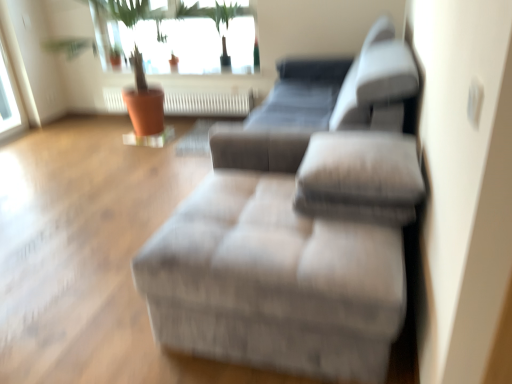
Measure the distance between transparent glass window at upper center, acting as the 1th window starting from the right, and camera.

transparent glass window at upper center, acting as the 1th window starting from the right, is 3.74 meters from camera.

Locate an element on the screen. silver metallic radiator at center is located at coordinates (211, 103).

From a real-world perspective, between silver metallic radiator at center and textured gray ottoman at center, who is vertically higher?

textured gray ottoman at center.

Is silver metallic radiator at center at the left side of textured gray ottoman at center?

Indeed, silver metallic radiator at center is positioned on the left side of textured gray ottoman at center.

Is point (232, 115) less distant than point (412, 161)?

No.

Looking at this image, can we say white glass window at upper left, which is the 2th window from right to left, lies outside silver metallic radiator at center?

white glass window at upper left, which is the 2th window from right to left, is positioned outside silver metallic radiator at center.

At what (x,y) coordinates should I click in order to perform the action: click on window on the left of silver metallic radiator at center. Please return your answer as a coordinate pair (x, y). Looking at the image, I should click on (10, 99).

Is white glass window at upper left, which is the 2th window from right to left, facing towards silver metallic radiator at center?

No, white glass window at upper left, which is the 2th window from right to left, is not turned towards silver metallic radiator at center.

Which of these two, white glass window at upper left, which ranks as the 1th window in left-to-right order, or silver metallic radiator at center, is bigger?

Bigger between the two is silver metallic radiator at center.

Does point (212, 92) come closer to viewer compared to point (231, 42)?

That is False.

How distant is silver metallic radiator at center from transparent glass window at upper center, acting as the 1th window starting from the right?

The distance of silver metallic radiator at center from transparent glass window at upper center, acting as the 1th window starting from the right, is 22.61 inches.

Where is `radiator located on the left of transparent glass window at upper center, which ranks as the second window in left-to-right order`? The image size is (512, 384). radiator located on the left of transparent glass window at upper center, which ranks as the second window in left-to-right order is located at coordinates (211, 103).

Can you confirm if silver metallic radiator at center is smaller than transparent glass window at upper center, which ranks as the second window in left-to-right order?

Correct, silver metallic radiator at center occupies less space than transparent glass window at upper center, which ranks as the second window in left-to-right order.

Can you confirm if textured gray ottoman at center is thinner than white glass window at upper left, which ranks as the 1th window in left-to-right order?

Incorrect, the width of textured gray ottoman at center is not less than that of white glass window at upper left, which ranks as the 1th window in left-to-right order.

Is textured gray ottoman at center in contact with white glass window at upper left, which ranks as the 1th window in left-to-right order?

No, textured gray ottoman at center is not making contact with white glass window at upper left, which ranks as the 1th window in left-to-right order.

From a real-world perspective, is textured gray ottoman at center positioned over white glass window at upper left, which ranks as the 1th window in left-to-right order, based on gravity?

Actually, textured gray ottoman at center is physically below white glass window at upper left, which ranks as the 1th window in left-to-right order, in the real world.

Considering the positions of objects white glass window at upper left, which is the 2th window from right to left, and textured gray ottoman at center in the image provided, who is behind, white glass window at upper left, which is the 2th window from right to left, or textured gray ottoman at center?

white glass window at upper left, which is the 2th window from right to left, is more distant.

Considering the positions of points (9, 62) and (365, 230), is point (9, 62) farther from camera compared to point (365, 230)?

Yes, it is.

Which is more to the left, white glass window at upper left, which ranks as the 1th window in left-to-right order, or textured gray ottoman at center?

Positioned to the left is white glass window at upper left, which ranks as the 1th window in left-to-right order.

From the picture: From the image's perspective, is white glass window at upper left, which is the 2th window from right to left, under textured gray ottoman at center?

Actually, white glass window at upper left, which is the 2th window from right to left, appears above textured gray ottoman at center in the image.

Between point (233, 96) and point (0, 113), which one is positioned behind?

Point (0, 113)

Would you say silver metallic radiator at center is inside or outside white glass window at upper left, which is the 2th window from right to left?

silver metallic radiator at center is outside white glass window at upper left, which is the 2th window from right to left.

Which object is thinner, silver metallic radiator at center or white glass window at upper left, which is the 2th window from right to left?

white glass window at upper left, which is the 2th window from right to left, is thinner.

From the image's perspective, is silver metallic radiator at center on white glass window at upper left, which is the 2th window from right to left?

No.

From the picture: Based on their positions, is transparent glass window at upper center, acting as the 1th window starting from the right, located to the left or right of textured gray ottoman at center?

In the image, transparent glass window at upper center, acting as the 1th window starting from the right, appears on the left side of textured gray ottoman at center.

Is transparent glass window at upper center, acting as the 1th window starting from the right, taller or shorter than textured gray ottoman at center?

In the image, transparent glass window at upper center, acting as the 1th window starting from the right, appears to be taller than textured gray ottoman at center.

Is transparent glass window at upper center, which ranks as the second window in left-to-right order, turned away from textured gray ottoman at center?

No.

Is the surface of transparent glass window at upper center, acting as the 1th window starting from the right, in direct contact with textured gray ottoman at center?

No, transparent glass window at upper center, acting as the 1th window starting from the right, is not in contact with textured gray ottoman at center.

Where is `studio couch below the silver metallic radiator at center (from the image's perspective)`? This screenshot has width=512, height=384. studio couch below the silver metallic radiator at center (from the image's perspective) is located at coordinates (298, 234).

The image size is (512, 384). In order to click on radiator that is behind the white glass window at upper left, which is the 2th window from right to left in this screenshot , I will do `click(211, 103)`.

Considering their positions, is white glass window at upper left, which is the 2th window from right to left, positioned further to textured gray ottoman at center than silver metallic radiator at center?

white glass window at upper left, which is the 2th window from right to left, is further to textured gray ottoman at center.

Considering their positions, is silver metallic radiator at center positioned closer to white glass window at upper left, which ranks as the 1th window in left-to-right order, than transparent glass window at upper center, acting as the 1th window starting from the right?

transparent glass window at upper center, acting as the 1th window starting from the right, lies closer to white glass window at upper left, which ranks as the 1th window in left-to-right order, than the other object.

Based on their spatial positions, is white glass window at upper left, which ranks as the 1th window in left-to-right order, or textured gray ottoman at center closer to silver metallic radiator at center?

Among the two, white glass window at upper left, which ranks as the 1th window in left-to-right order, is located nearer to silver metallic radiator at center.

Which object lies nearer to the anchor point transparent glass window at upper center, acting as the 1th window starting from the right, silver metallic radiator at center or white glass window at upper left, which ranks as the 1th window in left-to-right order?

The object closer to transparent glass window at upper center, acting as the 1th window starting from the right, is silver metallic radiator at center.

Looking at the image, which one is located further to textured gray ottoman at center, transparent glass window at upper center, acting as the 1th window starting from the right, or silver metallic radiator at center?

silver metallic radiator at center is further to textured gray ottoman at center.

Based on the photo, which object lies nearer to the anchor point white glass window at upper left, which ranks as the 1th window in left-to-right order, transparent glass window at upper center, acting as the 1th window starting from the right, or textured gray ottoman at center?

The object closer to white glass window at upper left, which ranks as the 1th window in left-to-right order, is transparent glass window at upper center, acting as the 1th window starting from the right.

Looking at the image, which one is located further to silver metallic radiator at center, transparent glass window at upper center, acting as the 1th window starting from the right, or textured gray ottoman at center?

The object further to silver metallic radiator at center is textured gray ottoman at center.

Looking at the image, which one is located further to white glass window at upper left, which is the 2th window from right to left, textured gray ottoman at center or transparent glass window at upper center, acting as the 1th window starting from the right?

Among the two, textured gray ottoman at center is located further to white glass window at upper left, which is the 2th window from right to left.

Locate an element on the screen. The image size is (512, 384). window between textured gray ottoman at center and transparent glass window at upper center, which ranks as the second window in left-to-right order, from front to back is located at coordinates (x=10, y=99).

You are a GUI agent. You are given a task and a screenshot of the screen. Output one action in this format:
    pyautogui.click(x=<x>, y=<y>)
    Task: Click on the radiator situated between white glass window at upper left, which ranks as the 1th window in left-to-right order, and transparent glass window at upper center, acting as the 1th window starting from the right, from left to right
    The width and height of the screenshot is (512, 384).
    Given the screenshot: What is the action you would take?
    pyautogui.click(x=211, y=103)